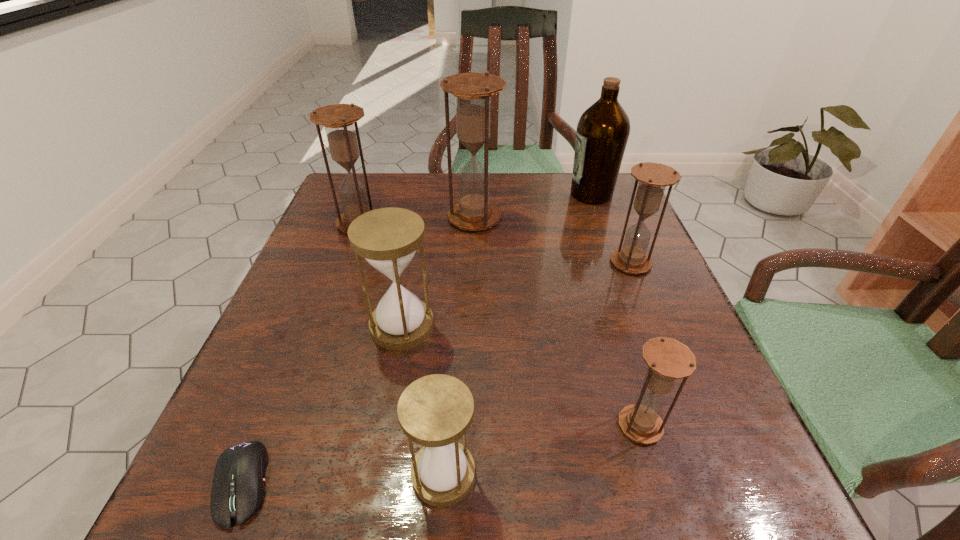
Where is `the third brown hourglass from left to right`? The image size is (960, 540). the third brown hourglass from left to right is located at coordinates (667, 359).

The height and width of the screenshot is (540, 960). Identify the location of the smaller white hourglass. (434, 411).

Locate an element on the screen. Image resolution: width=960 pixels, height=540 pixels. black computer equipment is located at coordinates (238, 490).

This screenshot has width=960, height=540. In order to click on computer equipment in this screenshot , I will do `click(238, 490)`.

Find the location of a particular element. The width and height of the screenshot is (960, 540). free space located 0.290m on the left of the third brown hourglass from right to left is located at coordinates (327, 218).

I want to click on vacant area situated 0.190m on the label of the brown olive oil, so click(x=495, y=194).

Identify the location of vacant space located 0.080m on the label of the brown olive oil. click(x=538, y=194).

Locate an element on the screen. free space located 0.210m on the label of the brown olive oil is located at coordinates (488, 194).

Locate an element on the screen. The width and height of the screenshot is (960, 540). free region located on the right of the leftmost hourglass is located at coordinates (442, 223).

What are the coordinates of `vacant space situated on the left of the second smallest brown hourglass` in the screenshot? It's located at (525, 263).